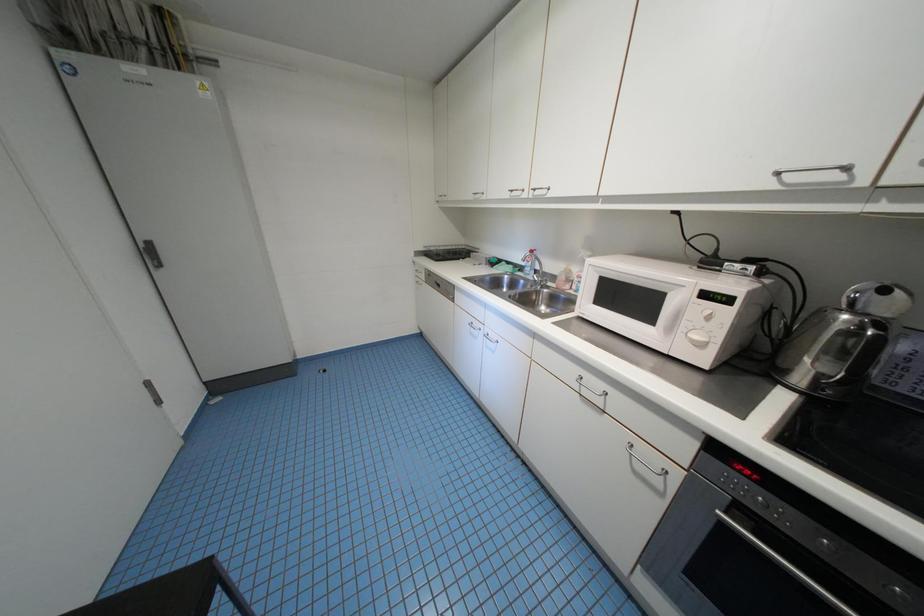
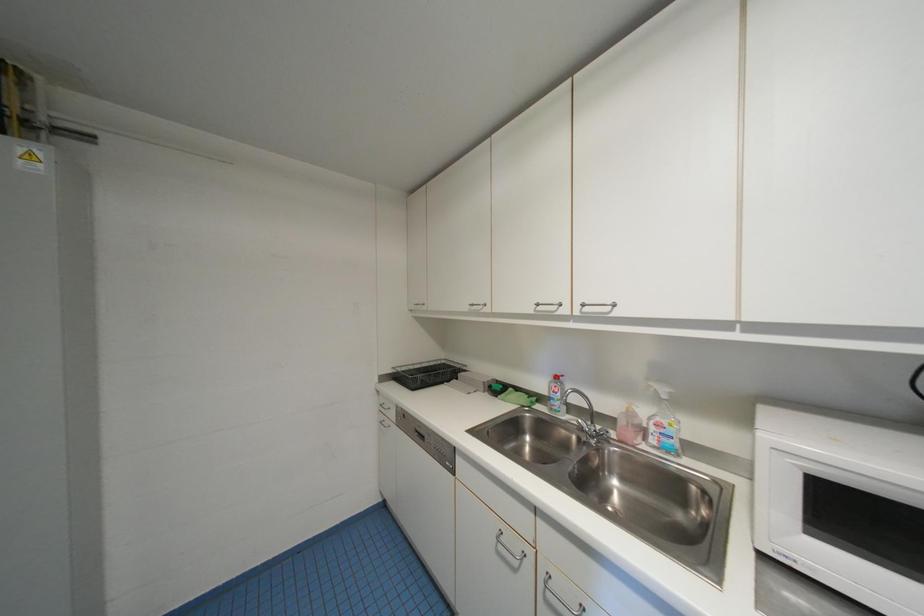
What movement of the cameraman would produce the second image?

The movement direction of the cameraman is left, forward.